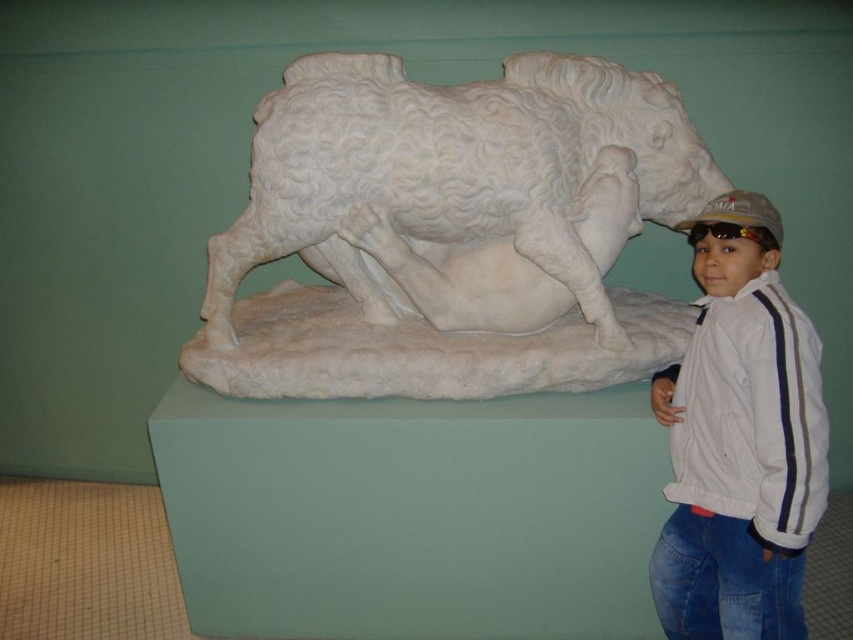
Question: Which object is the closest to the white cotton jacket at lower right?

Choices:
 (A) white matte baseball cap at upper right
 (B) white marble sculpture at center

Answer: (A)

Question: Is white marble sculpture at center below white cotton jacket at lower right?

Choices:
 (A) no
 (B) yes

Answer: (A)

Question: Is white marble sculpture at center above white matte baseball cap at upper right?

Choices:
 (A) no
 (B) yes

Answer: (B)

Question: Which point is closer to the camera?

Choices:
 (A) (662, 572)
 (B) (184, 371)
 (C) (686, 220)

Answer: (C)

Question: From the image, what is the correct spatial relationship of white marble sculpture at center in relation to white matte baseball cap at upper right?

Choices:
 (A) left
 (B) right

Answer: (A)

Question: Which point appears farthest from the camera in this image?

Choices:
 (A) (751, 204)
 (B) (751, 552)
 (C) (285, 195)

Answer: (C)